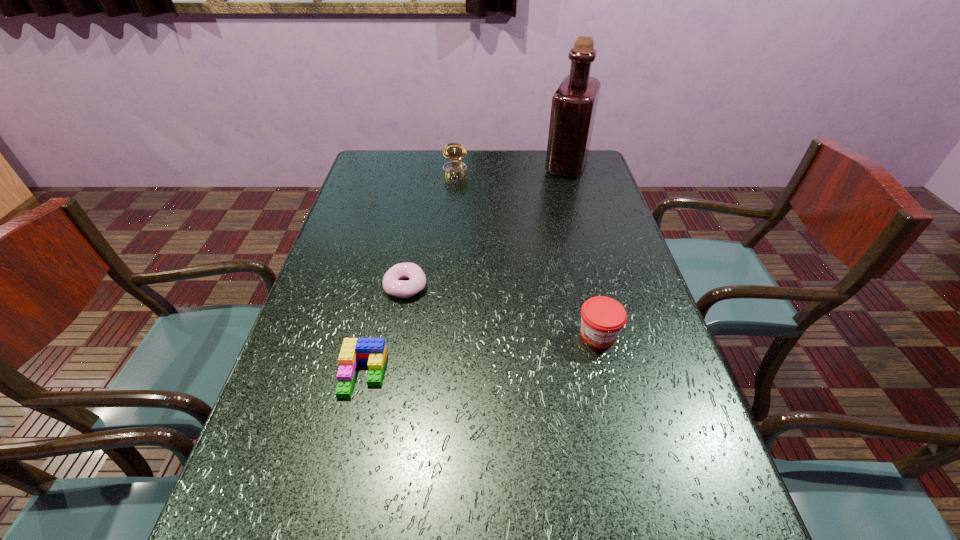
At what (x,y) coordinates should I click in order to perform the action: click on free space located 0.060m with the dial facing the fourth shortest object. Please return your answer as a coordinate pair (x, y). The height and width of the screenshot is (540, 960). Looking at the image, I should click on (454, 191).

Locate an element on the screen. The image size is (960, 540). free space located on the label side of the jam is located at coordinates (613, 396).

This screenshot has width=960, height=540. I want to click on vacant space positioned 0.360m on the right of the Lego, so click(554, 375).

Identify the location of blank space located 0.130m on the back of the third farthest object. click(414, 241).

Where is `liquor that is positioned at the far edge`? The image size is (960, 540). liquor that is positioned at the far edge is located at coordinates (574, 104).

You are a GUI agent. You are given a task and a screenshot of the screen. Output one action in this format:
    pyautogui.click(x=<x>, y=<y>)
    Task: Click on the compass that is at the far edge
    This screenshot has width=960, height=540.
    Given the screenshot: What is the action you would take?
    pyautogui.click(x=454, y=151)

Locate an element on the screen. object at the left edge is located at coordinates (372, 351).

The height and width of the screenshot is (540, 960). Find the location of `liquor that is at the right edge`. liquor that is at the right edge is located at coordinates (574, 104).

This screenshot has height=540, width=960. Find the location of `jam at the right edge`. jam at the right edge is located at coordinates (602, 318).

You are a GUI agent. You are given a task and a screenshot of the screen. Output one action in this format:
    pyautogui.click(x=<x>, y=<y>)
    Task: Click on the object located at the far right corner
    The width and height of the screenshot is (960, 540).
    Given the screenshot: What is the action you would take?
    pyautogui.click(x=574, y=104)